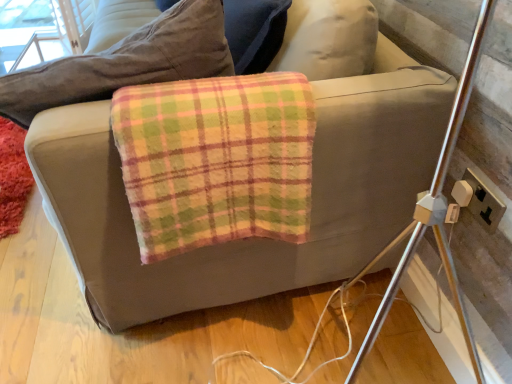
Question: Is plaid fleece blanket at center smaller than fluffy red mat at lower left?

Choices:
 (A) no
 (B) yes

Answer: (A)

Question: From a real-world perspective, is plaid fleece blanket at center on fluffy red mat at lower left?

Choices:
 (A) no
 (B) yes

Answer: (B)

Question: Is plaid fleece blanket at center shorter than fluffy red mat at lower left?

Choices:
 (A) no
 (B) yes

Answer: (A)

Question: Is plaid fleece blanket at center not near fluffy red mat at lower left?

Choices:
 (A) yes
 (B) no

Answer: (A)

Question: Does plaid fleece blanket at center turn towards fluffy red mat at lower left?

Choices:
 (A) yes
 (B) no

Answer: (B)

Question: Is point (472, 205) positioned closer to the camera than point (248, 155)?

Choices:
 (A) farther
 (B) closer

Answer: (A)

Question: Is gold plastic electrical outlet at right in front of or behind plaid fleece blanket at center in the image?

Choices:
 (A) front
 (B) behind

Answer: (B)

Question: In terms of size, does gold plastic electrical outlet at right appear bigger or smaller than plaid fleece blanket at center?

Choices:
 (A) big
 (B) small

Answer: (B)

Question: Would you say gold plastic electrical outlet at right is inside or outside plaid fleece blanket at center?

Choices:
 (A) inside
 (B) outside

Answer: (B)

Question: From the image's perspective, relative to gold plastic electrical outlet at right, is fluffy red mat at lower left above or below?

Choices:
 (A) above
 (B) below

Answer: (A)

Question: Which is correct: fluffy red mat at lower left is inside gold plastic electrical outlet at right, or outside of it?

Choices:
 (A) outside
 (B) inside

Answer: (A)

Question: Is point (7, 144) closer or farther from the camera than point (468, 208)?

Choices:
 (A) farther
 (B) closer

Answer: (A)

Question: Is fluffy red mat at lower left taller or shorter than gold plastic electrical outlet at right?

Choices:
 (A) short
 (B) tall

Answer: (A)

Question: From a real-world perspective, is plaid fleece blanket at center physically located above or below gold plastic electrical outlet at right?

Choices:
 (A) below
 (B) above

Answer: (B)

Question: Considering the positions of plaid fleece blanket at center and gold plastic electrical outlet at right in the image, is plaid fleece blanket at center bigger or smaller than gold plastic electrical outlet at right?

Choices:
 (A) small
 (B) big

Answer: (B)